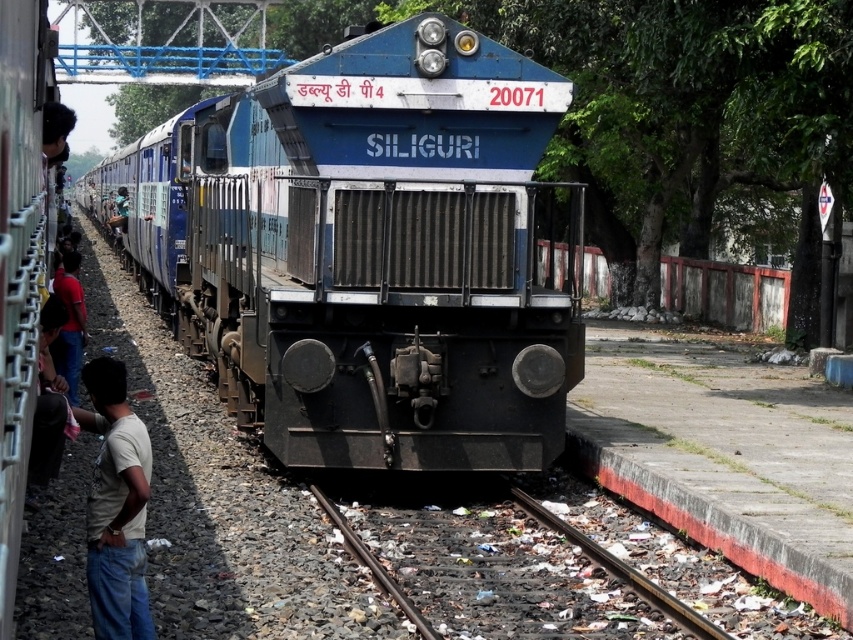
You are a passenger waiting at the station and see the smooth metal train track at center and the blue fabric shirt at left. Which object is taller?

The blue fabric shirt at left is taller than the smooth metal train track at center.

You are a passenger waiting on the platform and want to board the blue metallic train at center. Which direction should you walk to reach it from the dark blue shirt at left?

The blue metallic train at center is positioned over the dark blue shirt at left, so you should walk towards the center of the platform to reach it.